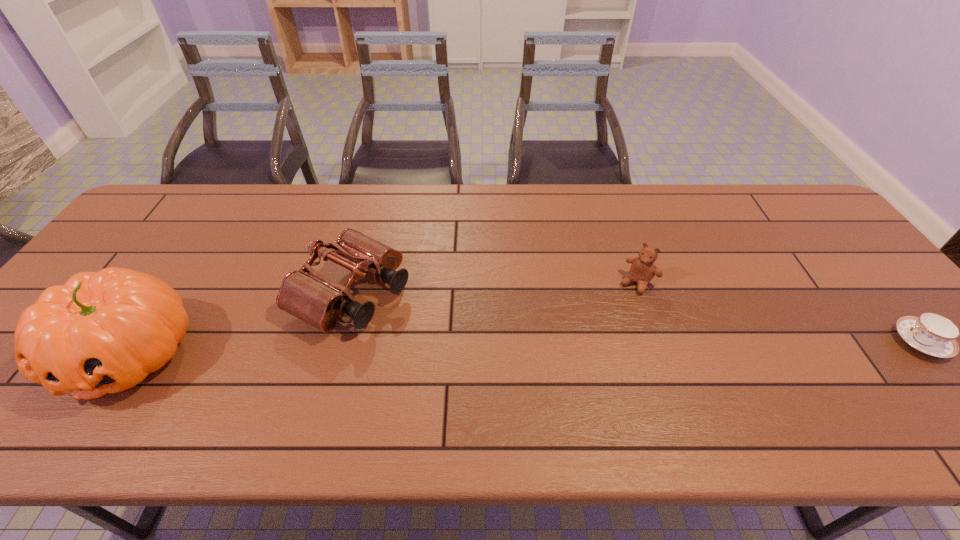
Where is `the tallest object`? the tallest object is located at coordinates (102, 332).

The height and width of the screenshot is (540, 960). In order to click on pumpkin in this screenshot , I will do `click(102, 332)`.

You are a GUI agent. You are given a task and a screenshot of the screen. Output one action in this format:
    pyautogui.click(x=<x>, y=<y>)
    Task: Click on the third object from left to right
    Image resolution: width=960 pixels, height=540 pixels.
    Given the screenshot: What is the action you would take?
    pyautogui.click(x=643, y=269)

The image size is (960, 540). I want to click on the third tallest object, so pos(643,269).

This screenshot has height=540, width=960. Identify the location of the third object from right to left. [x=305, y=294].

Identify the location of the second tallest object. (305, 294).

The width and height of the screenshot is (960, 540). I want to click on vacant position located 0.250m on the face of the third object from left to right, so click(582, 356).

This screenshot has height=540, width=960. In order to click on vacant space situated on the face of the third object from left to right in this screenshot , I will do coord(595,340).

Find the location of a particular element. This screenshot has width=960, height=540. vacant point located on the face of the third object from left to right is located at coordinates (560, 386).

The width and height of the screenshot is (960, 540). I want to click on free space located through the eyepieces of the third object from right to left, so click(506, 376).